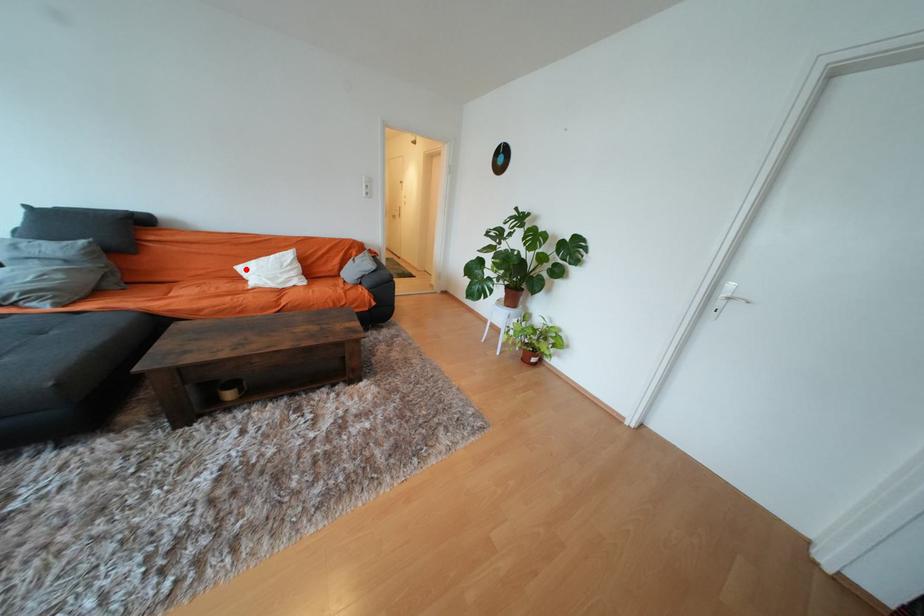
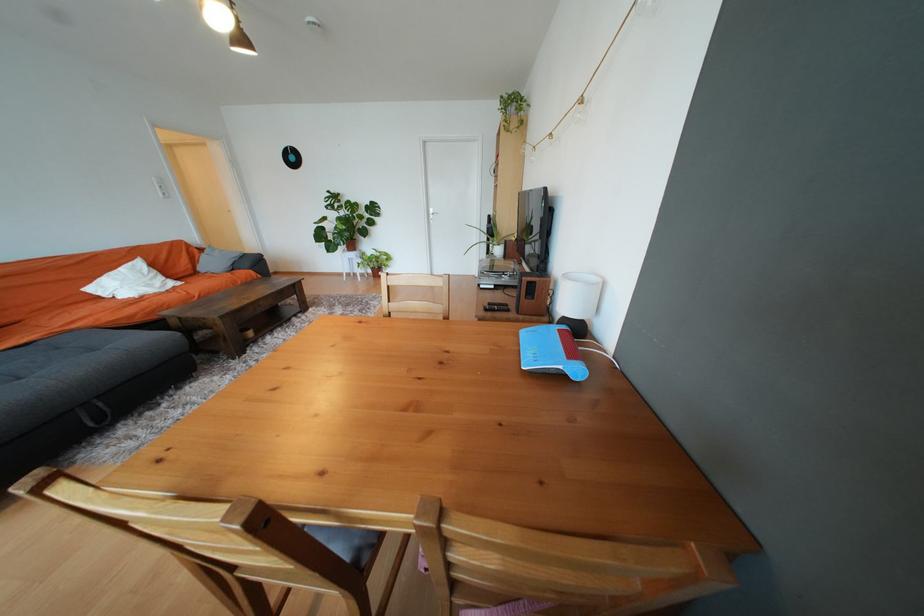
Find the pixel in the second image that matches the highlighted location in the first image.

(96, 291)